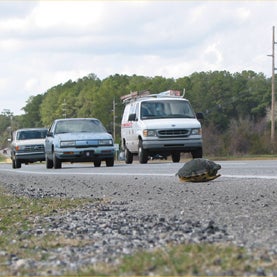
At what (x,y) coordinates should I click in order to perform the action: click on lights. Please return your answer as a coordinate pair (x, y). The height and width of the screenshot is (277, 277). Looking at the image, I should click on point(104,141).